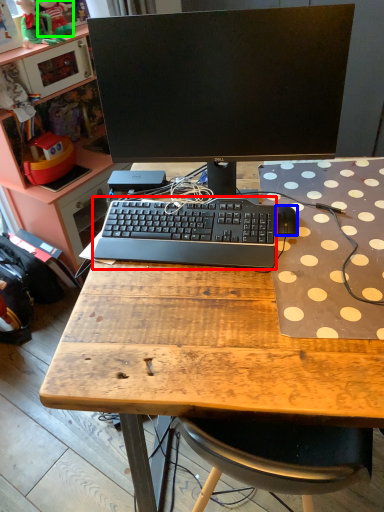
Question: Considering the real-world distances, which object is closest to computer keyboard (highlighted by a red box)? mouse (highlighted by a blue box) or toy (highlighted by a green box).

Choices:
 (A) mouse
 (B) toy

Answer: (A)